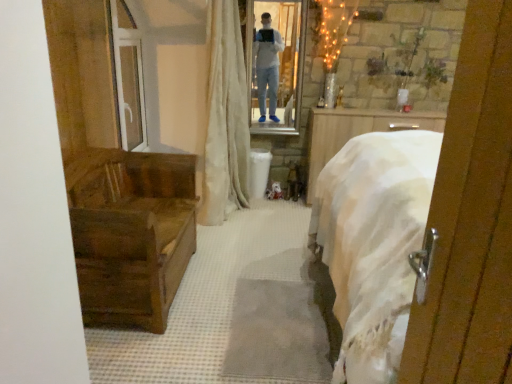
Question: Does beige fabric curtain at center have a greater width compared to wooden chest at left?

Choices:
 (A) yes
 (B) no

Answer: (B)

Question: From a real-world perspective, is beige fabric curtain at center physically below wooden chest at left?

Choices:
 (A) yes
 (B) no

Answer: (B)

Question: Does beige fabric curtain at center have a larger size compared to wooden chest at left?

Choices:
 (A) yes
 (B) no

Answer: (A)

Question: Is beige fabric curtain at center placed right next to wooden chest at left?

Choices:
 (A) no
 (B) yes

Answer: (A)

Question: Does beige fabric curtain at center lie behind wooden chest at left?

Choices:
 (A) yes
 (B) no

Answer: (A)

Question: Considering the positions of point (209, 86) and point (116, 21), is point (209, 86) closer or farther from the camera than point (116, 21)?

Choices:
 (A) closer
 (B) farther

Answer: (B)

Question: Looking at their shapes, would you say beige fabric curtain at center is wider or thinner than transparent glass door at upper left?

Choices:
 (A) thin
 (B) wide

Answer: (B)

Question: Relative to transparent glass door at upper left, is beige fabric curtain at center in front or behind?

Choices:
 (A) behind
 (B) front

Answer: (B)

Question: Which is correct: beige fabric curtain at center is inside transparent glass door at upper left, or outside of it?

Choices:
 (A) inside
 (B) outside

Answer: (B)

Question: Is wooden chest at left inside or outside of white glossy mirror at upper center?

Choices:
 (A) inside
 (B) outside

Answer: (B)

Question: From the image's perspective, is wooden chest at left located above or below white glossy mirror at upper center?

Choices:
 (A) above
 (B) below

Answer: (B)

Question: From a real-world perspective, relative to white glossy mirror at upper center, is wooden chest at left vertically above or below?

Choices:
 (A) above
 (B) below

Answer: (B)

Question: Is wooden chest at left wider or thinner than white glossy mirror at upper center?

Choices:
 (A) thin
 (B) wide

Answer: (B)

Question: Is point (287, 8) positioned closer to the camera than point (137, 135)?

Choices:
 (A) farther
 (B) closer

Answer: (A)

Question: Considering the relative positions of white glossy mirror at upper center and transparent glass door at upper left in the image provided, is white glossy mirror at upper center to the left or to the right of transparent glass door at upper left?

Choices:
 (A) right
 (B) left

Answer: (A)